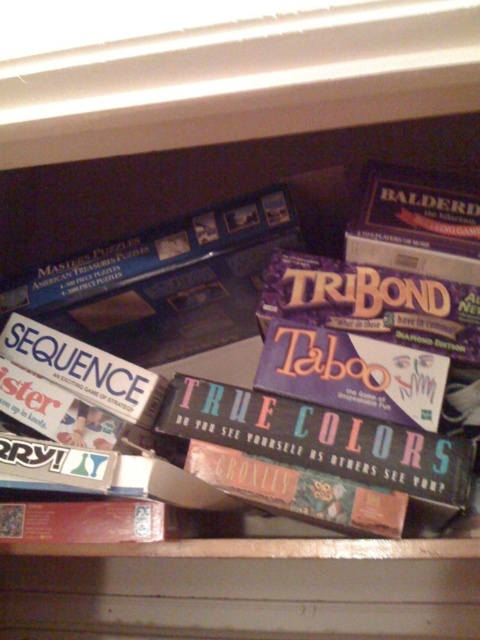
You are organizing a game night and need to place the matte cardboard true colors at center and the brown cardboard box at center on a shelf. Which one will you place higher up to ensure it doesn not topple over?

The matte cardboard true colors at center should be placed higher up since it is much taller than the brown cardboard box at center, reducing the risk of it toppling over.

Looking at this image, you are organizing a game night and need to retrieve the TriBond game. You see the matte cardboard true colors at center and the brown cardboard box at center. Which one should you move first to access the TriBond game?

The matte cardboard true colors at center is positioned over the brown cardboard box at center, so you should move the matte cardboard true colors at center first to access the TriBond game.